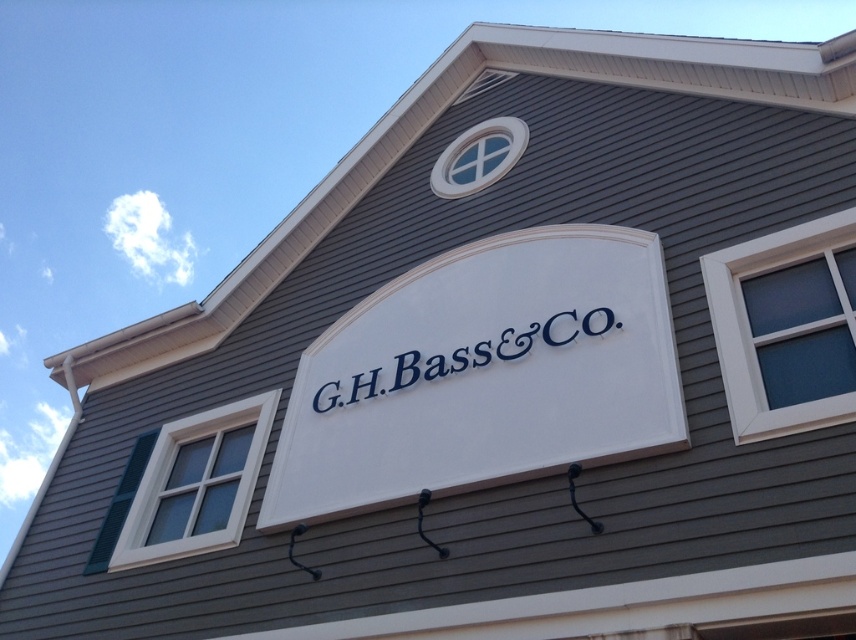
Question: From the image, what is the correct spatial relationship of white matte sign at center in relation to white painted signboard at center?

Choices:
 (A) below
 (B) above

Answer: (A)

Question: Is white matte sign at center bigger than white painted signboard at center?

Choices:
 (A) yes
 (B) no

Answer: (A)

Question: Is white matte sign at center closer to camera compared to white painted signboard at center?

Choices:
 (A) yes
 (B) no

Answer: (A)